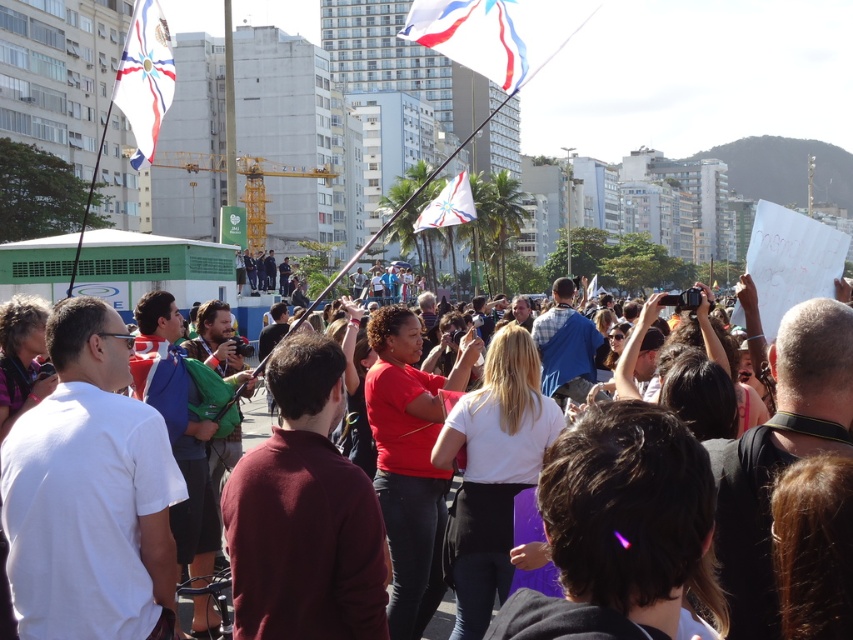
You are a photographer trying to capture the crowd holding signs and flags. You notice the white fabric flag at upper left and the matte black camera at center. Which object is blocking your view of the other?

The white fabric flag at upper left is positioned over the matte black camera at center, so it is blocking the view of the matte black camera at center.

You are a photographer at the event and want to capture the matte black camera at center without the white fabric flag at upper center blocking it. How should you adjust your position?

Move your position downward so that the matte black camera at center is no longer under the white fabric flag at upper center, which is above it.

You are a photographer at the event. You want to take a photo of the crowd without any obstructions. The matte black camera at center is under the white fabric flag at center. Will the flag block the camera lens when taking the photo?

The matte black camera at center is positioned under the white fabric flag at center, so the flag will block the camera lens when taking the photo.